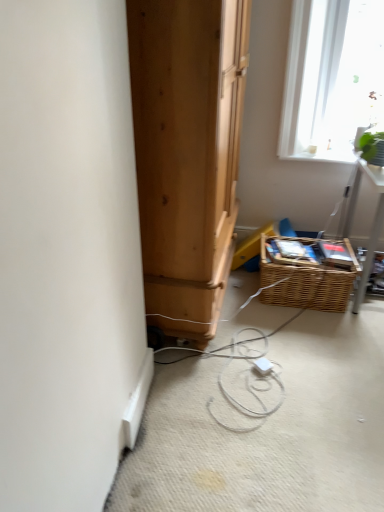
Question: From the image's perspective, is green leafy plant at upper right located above or below white plastic extension cord at center?

Choices:
 (A) above
 (B) below

Answer: (A)

Question: Is green leafy plant at upper right taller or shorter than white plastic extension cord at center?

Choices:
 (A) short
 (B) tall

Answer: (B)

Question: Considering the real-world distances, which object is farthest from the green leafy plant at upper right?

Choices:
 (A) woven brown basket at lower right
 (B) white plastic extension cord at center

Answer: (B)

Question: Estimate the real-world distances between objects in this image. Which object is closer to the white plastic extension cord at center?

Choices:
 (A) woven brown basket at lower right
 (B) green leafy plant at upper right

Answer: (A)